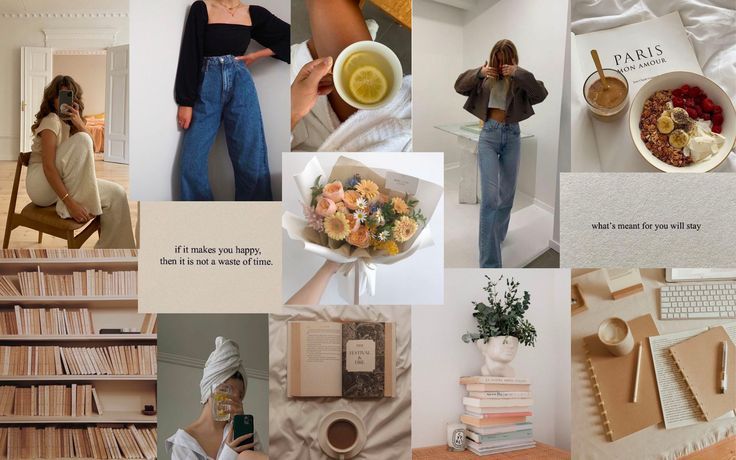
Identify the location of cups. Image resolution: width=736 pixels, height=460 pixels. (371, 78), (620, 334), (601, 97), (347, 436).